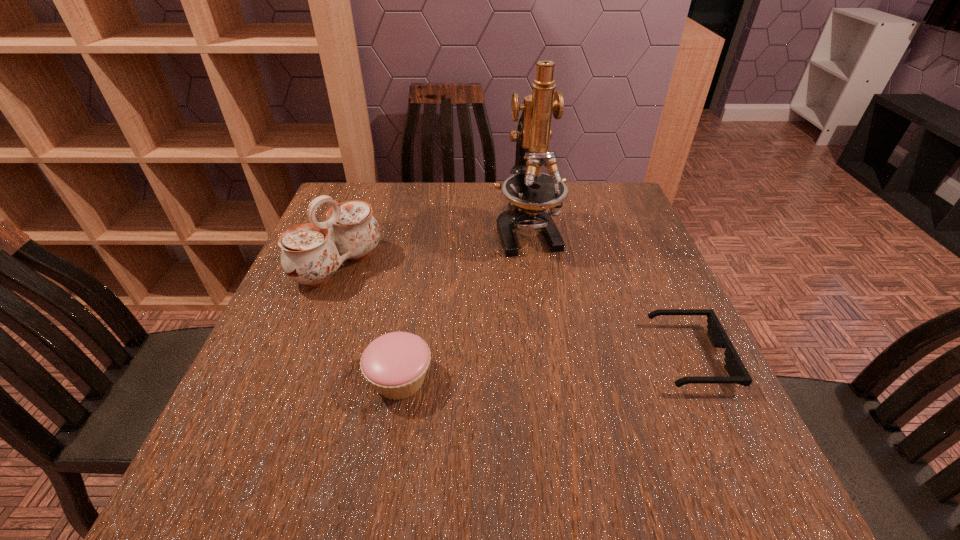
Locate an element on the screen. The height and width of the screenshot is (540, 960). free space on the desktop that is between the third tallest object and the rightmost object and is positioned by the handle of the chinaware is located at coordinates (506, 371).

This screenshot has width=960, height=540. I want to click on vacant space on the desktop that is between the cupcake and the sunglasses and is positioned at the eyepiece of the second object from right to left, so click(x=582, y=365).